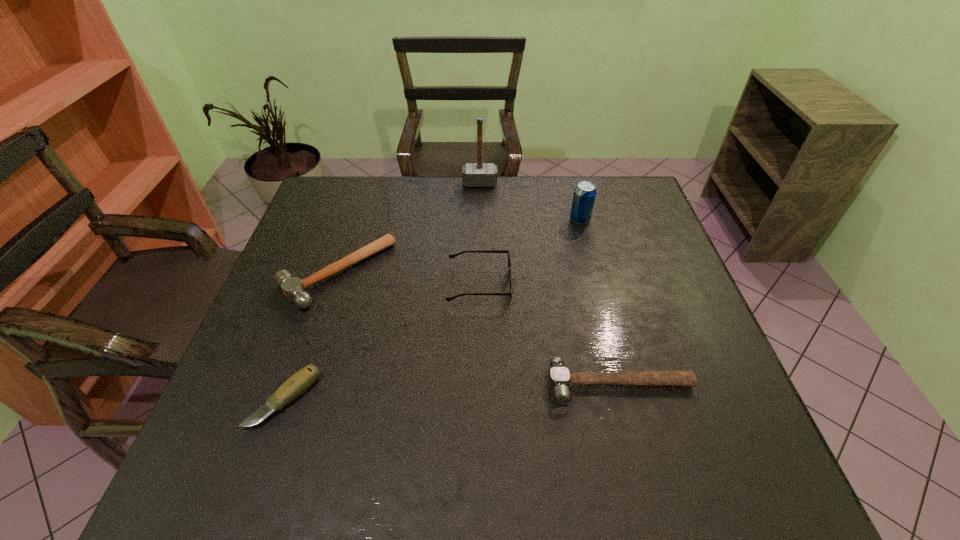
The image size is (960, 540). Identify the location of the second hammer from right to left. tap(479, 174).

What are the coordinates of `the tallest hammer` in the screenshot? It's located at (479, 174).

Identify the location of beer can. This screenshot has height=540, width=960. (584, 195).

Find the location of `the second farthest object`. the second farthest object is located at coordinates (584, 195).

Locate an element on the screen. The width and height of the screenshot is (960, 540). the third tallest object is located at coordinates (451, 256).

Where is `the leftmost hammer`? Image resolution: width=960 pixels, height=540 pixels. the leftmost hammer is located at coordinates (293, 288).

This screenshot has width=960, height=540. Find the location of `the rightmost hammer`. the rightmost hammer is located at coordinates (559, 376).

Where is `the shortest hammer`? Image resolution: width=960 pixels, height=540 pixels. the shortest hammer is located at coordinates (559, 376).

Identify the location of the shortest object. This screenshot has height=540, width=960. (302, 380).

This screenshot has height=540, width=960. I want to click on vacant space located 0.170m on the striking surface of the tallest hammer, so click(x=480, y=221).